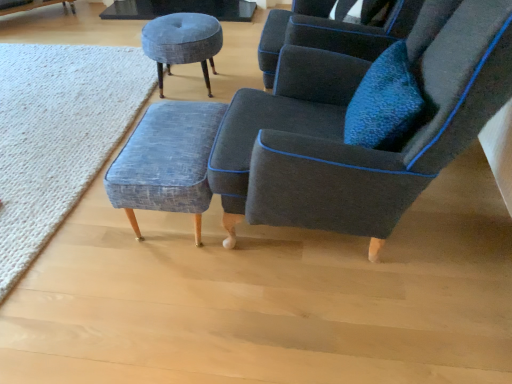
Question: Is there a large distance between textured blue fabric stool at center, acting as the first stool starting from the front, and textured wool rug at lower left?

Choices:
 (A) yes
 (B) no

Answer: (B)

Question: Is textured blue fabric stool at center, which is the 1th stool in bottom-to-top order, turned away from textured wool rug at lower left?

Choices:
 (A) no
 (B) yes

Answer: (A)

Question: Does textured blue fabric stool at center, which is the 1th stool in bottom-to-top order, have a lesser width compared to textured wool rug at lower left?

Choices:
 (A) no
 (B) yes

Answer: (B)

Question: Can we say textured blue fabric stool at center, acting as the first stool starting from the front, lies outside textured wool rug at lower left?

Choices:
 (A) no
 (B) yes

Answer: (B)

Question: Is textured blue fabric stool at center, acting as the 2th stool starting from the top, bigger than textured wool rug at lower left?

Choices:
 (A) no
 (B) yes

Answer: (A)

Question: From a real-world perspective, relative to dark gray fabric chair at center, is textured gray stool at upper center, positioned as the first stool in top-to-bottom order, vertically above or below?

Choices:
 (A) below
 (B) above

Answer: (A)

Question: Visually, is textured gray stool at upper center, arranged as the second stool when viewed from the front, positioned to the left or to the right of dark gray fabric chair at center?

Choices:
 (A) right
 (B) left

Answer: (B)

Question: In the image, is textured gray stool at upper center, which appears as the 1th stool when viewed from the back, positioned in front of or behind dark gray fabric chair at center?

Choices:
 (A) behind
 (B) front

Answer: (A)

Question: Choose the correct answer: Is textured gray stool at upper center, which appears as the 1th stool when viewed from the back, inside dark gray fabric chair at center or outside it?

Choices:
 (A) inside
 (B) outside

Answer: (B)

Question: Is point (280, 173) closer or farther from the camera than point (172, 142)?

Choices:
 (A) farther
 (B) closer

Answer: (B)

Question: Visually, is dark gray fabric chair at center positioned to the left or to the right of textured blue fabric stool at center, which is counted as the 2th stool, starting from the back?

Choices:
 (A) left
 (B) right

Answer: (B)

Question: From a real-world perspective, is dark gray fabric chair at center physically located above or below textured blue fabric stool at center, acting as the 2th stool starting from the top?

Choices:
 (A) above
 (B) below

Answer: (A)

Question: Is dark gray fabric chair at center inside or outside of textured blue fabric stool at center, acting as the 2th stool starting from the top?

Choices:
 (A) inside
 (B) outside

Answer: (B)

Question: Is textured blue fabric stool at center, acting as the first stool starting from the front, in front of or behind textured wool rug at lower left in the image?

Choices:
 (A) front
 (B) behind

Answer: (A)

Question: From a real-world perspective, is textured blue fabric stool at center, which is the 1th stool in bottom-to-top order, positioned above or below textured wool rug at lower left?

Choices:
 (A) below
 (B) above

Answer: (B)